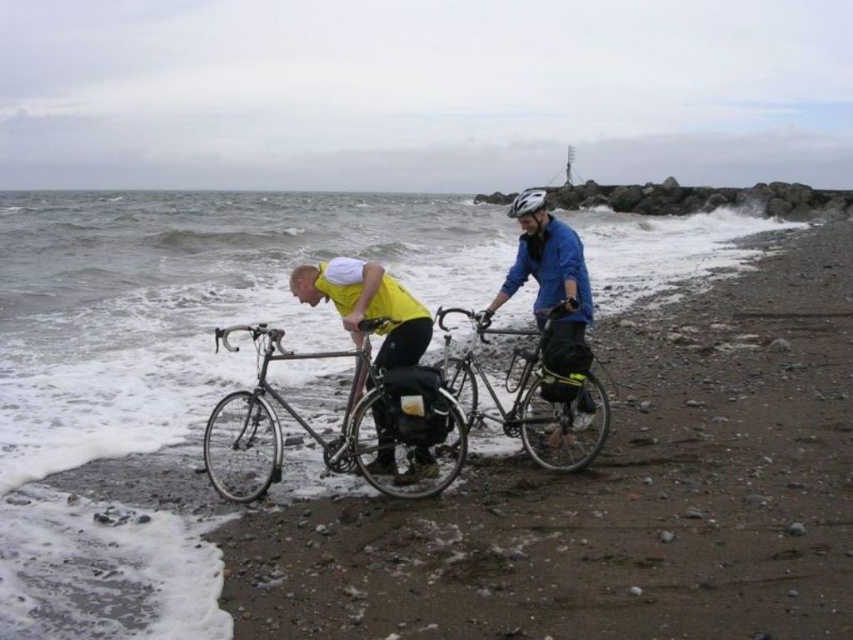
Between shiny black bicycle at center and blue matte jacket at center, which one appears on the right side from the viewer's perspective?

blue matte jacket at center

Is shiny black bicycle at center above blue matte jacket at center?

Incorrect, shiny black bicycle at center is not positioned above blue matte jacket at center.

Which is behind, point (427, 365) or point (584, 371)?

The point (584, 371) is behind.

Locate an element on the screen. shiny black bicycle at center is located at coordinates click(340, 422).

Does yellow fabric safety vest at center appear under white matte bicycle helmet at upper center?

Correct, yellow fabric safety vest at center is located below white matte bicycle helmet at upper center.

Can you confirm if yellow fabric safety vest at center is wider than white matte bicycle helmet at upper center?

Yes, yellow fabric safety vest at center is wider than white matte bicycle helmet at upper center.

Is point (350, 305) positioned before point (520, 195)?

Yes.

Where is `yellow fabric safety vest at center`? This screenshot has width=853, height=640. yellow fabric safety vest at center is located at coordinates (393, 304).

Is shiny metallic bicycle at center below yellow matte shirt at center?

Yes.

Who is positioned more to the left, shiny metallic bicycle at center or yellow matte shirt at center?

Positioned to the left is yellow matte shirt at center.

This screenshot has width=853, height=640. What do you see at coordinates (524, 396) in the screenshot?
I see `shiny metallic bicycle at center` at bounding box center [524, 396].

The height and width of the screenshot is (640, 853). Identify the location of shiny metallic bicycle at center. (524, 396).